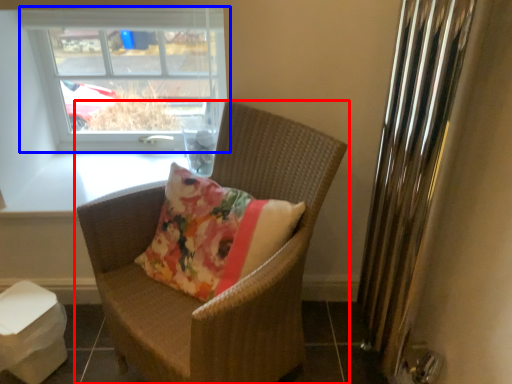
Question: Among these objects, which one is nearest to the camera, chair (highlighted by a red box) or window (highlighted by a blue box)?

Choices:
 (A) chair
 (B) window

Answer: (A)